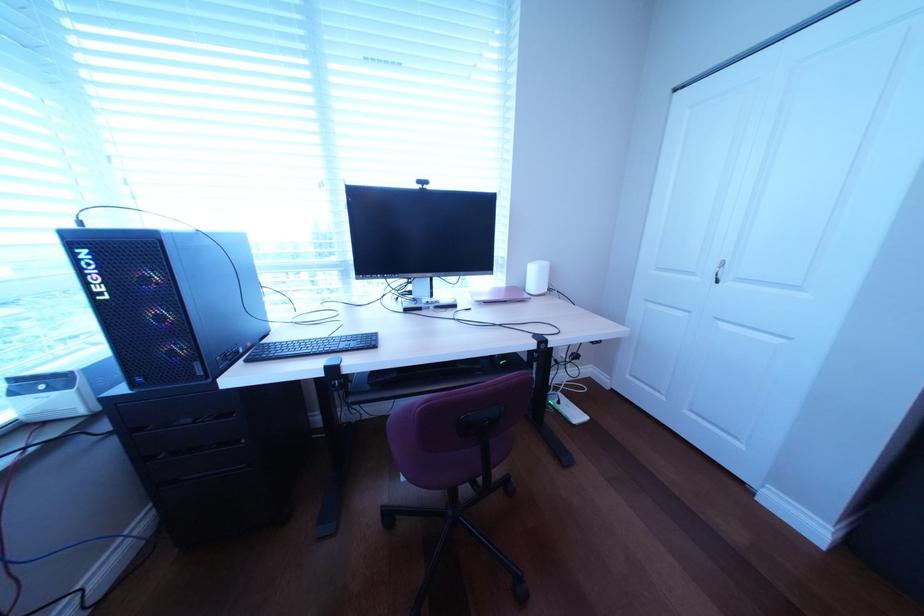
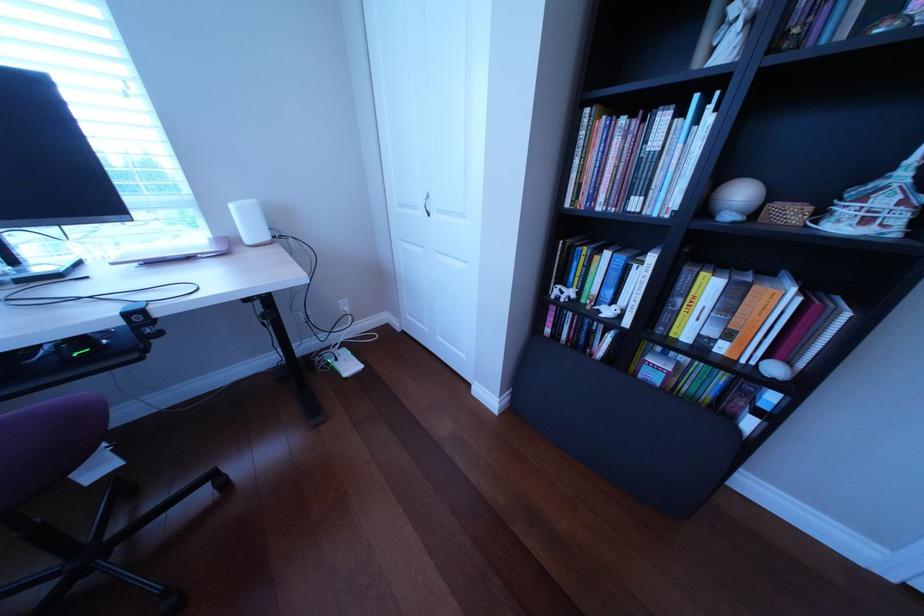
Question: The camera is either moving clockwise (left) or counter-clockwise (right) around the object. The first image is from the beginning of the video and the second image is from the end. Is the camera moving left or right when shooting the video?

Choices:
 (A) Left
 (B) Right

Answer: (A)